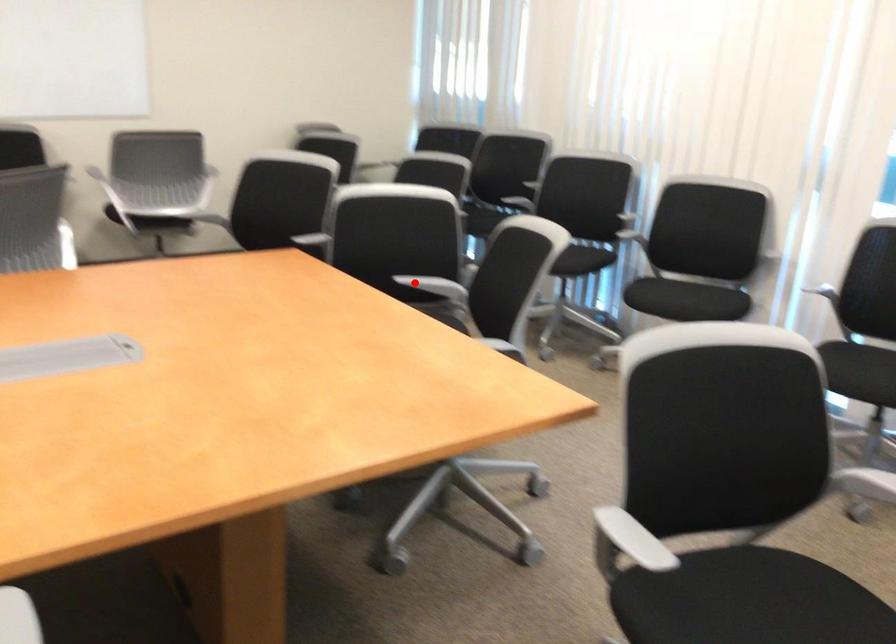
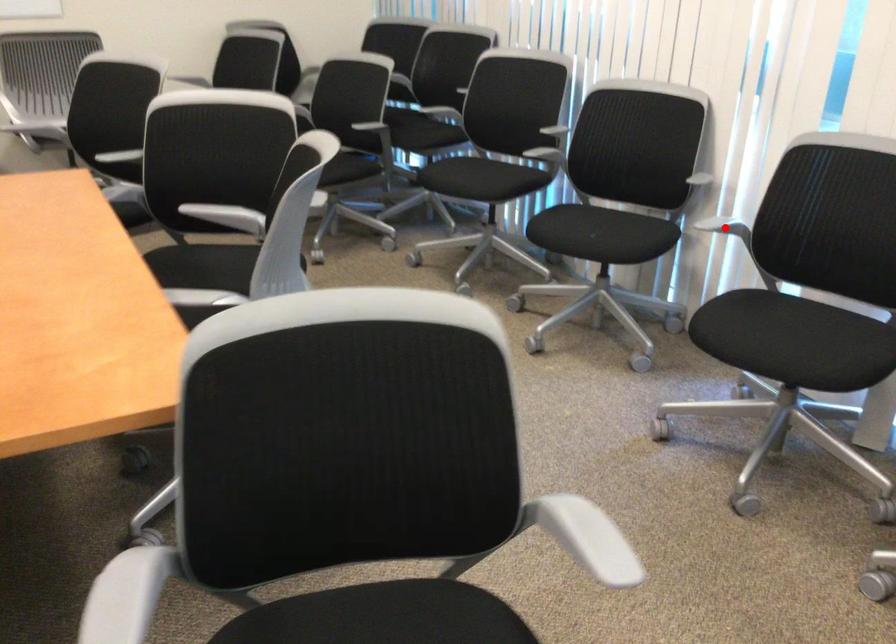
I am providing you with two images of the same scene from different viewpoints. A red point is marked on the first image and another point is marked on the second image. Is the red point in image1 aligned with the point shown in image2?

No